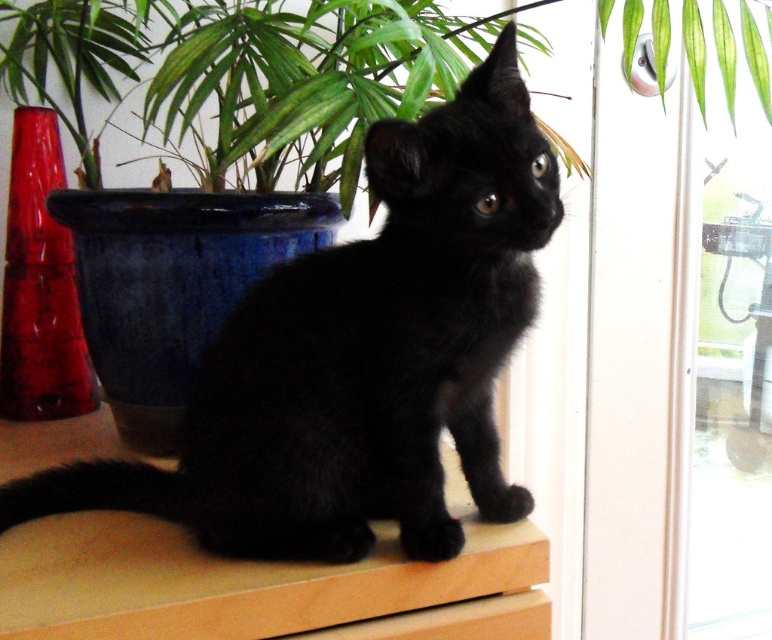
Question: Is black matte fur cat at center further to camera compared to glossy ceramic pot at upper center?

Choices:
 (A) yes
 (B) no

Answer: (B)

Question: Does black matte fur cat at center have a smaller size compared to glossy ceramic pot at upper center?

Choices:
 (A) yes
 (B) no

Answer: (A)

Question: Among these objects, which one is nearest to the camera?

Choices:
 (A) glossy ceramic pot at upper center
 (B) black matte fur cat at center

Answer: (B)

Question: Is black matte fur cat at center bigger than glossy ceramic pot at upper center?

Choices:
 (A) no
 (B) yes

Answer: (A)